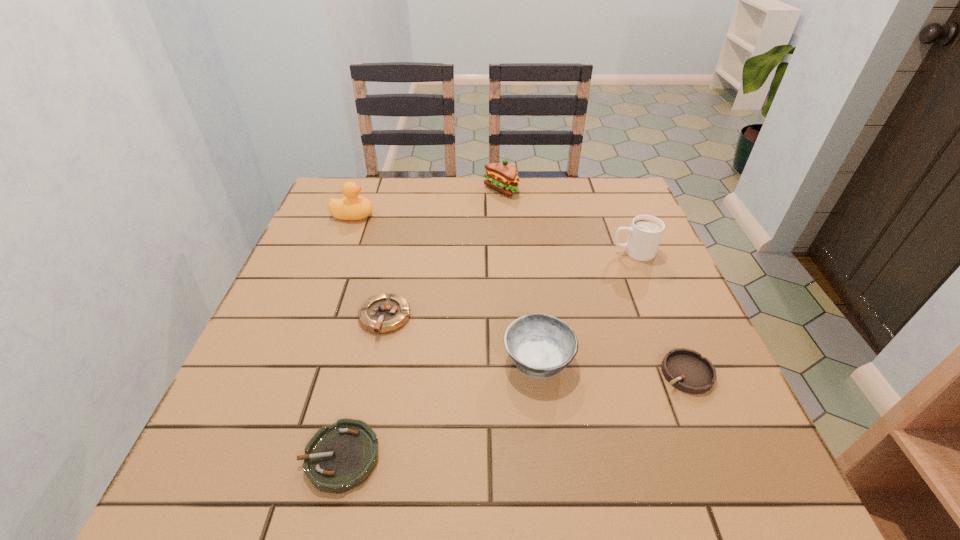
This screenshot has width=960, height=540. Find the location of `sandwich`. sandwich is located at coordinates (502, 177).

You are a GUI agent. You are given a task and a screenshot of the screen. Output one action in this format:
    pyautogui.click(x=<x>, y=<y>)
    Task: Click on the leftmost object
    The height and width of the screenshot is (540, 960).
    Given the screenshot: What is the action you would take?
    pyautogui.click(x=353, y=207)

Locate an element on the screen. duck is located at coordinates (353, 207).

The image size is (960, 540). Identify the location of the third farthest object. (645, 233).

Locate an element on the screen. Image resolution: width=960 pixels, height=540 pixels. the fifth shortest object is located at coordinates (645, 233).

The height and width of the screenshot is (540, 960). I want to click on the fourth shortest object, so click(x=540, y=345).

Find the location of a particular element. the third ashtray from left to right is located at coordinates (540, 345).

Identify the location of the rightmost ashtray. Image resolution: width=960 pixels, height=540 pixels. (686, 370).

Identify the location of the nearest object. (339, 457).

You are a GUI agent. You are given a task and a screenshot of the screen. Output one action in this format:
    pyautogui.click(x=<x>, y=<y>)
    Task: Click on the shortest ashtray
    The width and height of the screenshot is (960, 540).
    Given the screenshot: What is the action you would take?
    pyautogui.click(x=339, y=457)